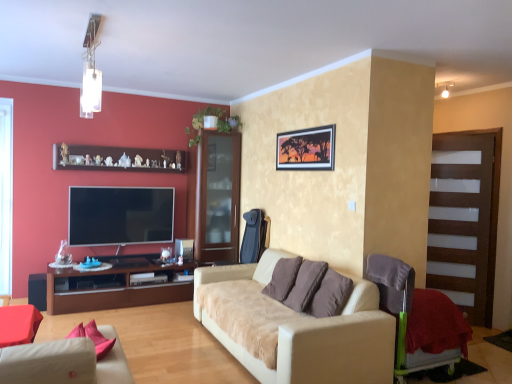
Question: Considering the relative sizes of flat screen tv at left and red textured blanket at lower right in the image provided, is flat screen tv at left bigger than red textured blanket at lower right?

Choices:
 (A) yes
 (B) no

Answer: (B)

Question: From the image's perspective, is flat screen tv at left beneath red textured blanket at lower right?

Choices:
 (A) no
 (B) yes

Answer: (A)

Question: Is flat screen tv at left wider than red textured blanket at lower right?

Choices:
 (A) yes
 (B) no

Answer: (B)

Question: From the image's perspective, is flat screen tv at left on top of red textured blanket at lower right?

Choices:
 (A) yes
 (B) no

Answer: (A)

Question: From a real-world perspective, is flat screen tv at left below red textured blanket at lower right?

Choices:
 (A) yes
 (B) no

Answer: (B)

Question: Does point (158, 299) appear closer or farther from the camera than point (352, 369)?

Choices:
 (A) closer
 (B) farther

Answer: (B)

Question: In terms of size, does brown wood cabinet at left appear bigger or smaller than beige fabric couch at center, positioned as the second studio couch in front-to-back order?

Choices:
 (A) big
 (B) small

Answer: (B)

Question: From a real-world perspective, relative to beige fabric couch at center, the 1th studio couch when ordered from back to front, is brown wood cabinet at left vertically above or below?

Choices:
 (A) below
 (B) above

Answer: (A)

Question: From their relative heights in the image, would you say brown wood cabinet at left is taller or shorter than beige fabric couch at center, the 1th studio couch when ordered from back to front?

Choices:
 (A) short
 (B) tall

Answer: (A)

Question: From the image's perspective, is matte red chair at lower left, the 2th chair viewed from the back, located above or below velvet purple chair at lower right, positioned as the 2th chair in left-to-right order?

Choices:
 (A) above
 (B) below

Answer: (A)

Question: Based on their positions, is matte red chair at lower left, the 2th chair viewed from the back, located to the left or right of velvet purple chair at lower right, which ranks as the 1th chair in right-to-left order?

Choices:
 (A) right
 (B) left

Answer: (B)

Question: Is point (6, 319) positioned closer to the camera than point (404, 306)?

Choices:
 (A) farther
 (B) closer

Answer: (B)

Question: From their relative heights in the image, would you say matte red chair at lower left, the 2th chair viewed from the back, is taller or shorter than velvet purple chair at lower right, which ranks as the 1th chair in right-to-left order?

Choices:
 (A) tall
 (B) short

Answer: (B)

Question: Looking at their shapes, would you say brown glass cabinet at center is wider or thinner than matte beige studio couch at lower left, positioned as the second studio couch in back-to-front order?

Choices:
 (A) thin
 (B) wide

Answer: (A)

Question: Considering the positions of brown glass cabinet at center and matte beige studio couch at lower left, arranged as the 1th studio couch when viewed from the front, in the image, is brown glass cabinet at center taller or shorter than matte beige studio couch at lower left, arranged as the 1th studio couch when viewed from the front,?

Choices:
 (A) tall
 (B) short

Answer: (A)